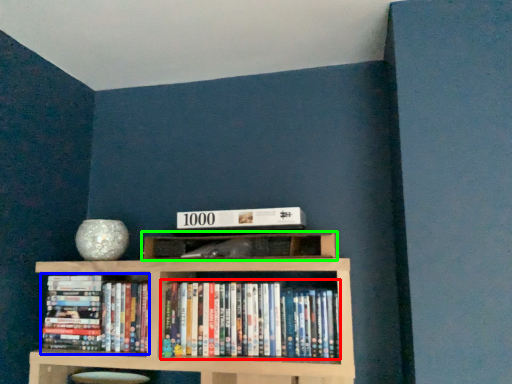
Question: Based on their relative distances, which object is farther from book (highlighted by a red box)? Choose from book (highlighted by a blue box) and shelf (highlighted by a green box).

Choices:
 (A) book
 (B) shelf

Answer: (A)